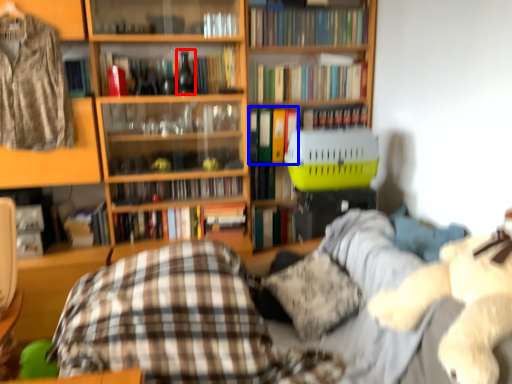
Question: Which object appears farthest to the camera in this image, wine bottle (highlighted by a red box) or book (highlighted by a blue box)?

Choices:
 (A) wine bottle
 (B) book

Answer: (B)